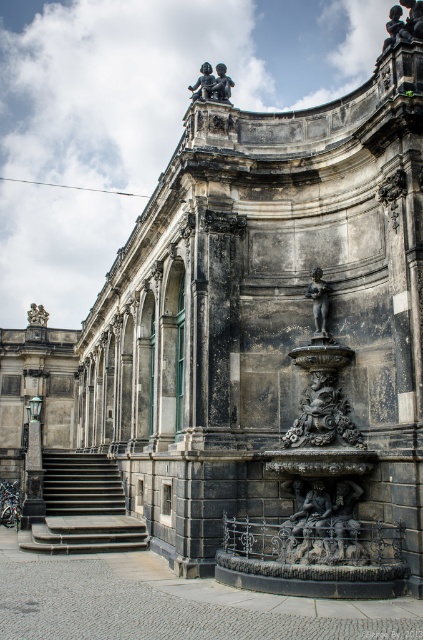
You are standing in front of the historical building and notice a specific point marked at coordinates (324, 522). Based on the scene description, can you determine which part of the structure this point is located on?

The point is located on the dark stone sculpture at lower center.

You are standing in front of the historical building and want to take a photo. There are two points marked in the image at coordinates point (114, 460) and point (417, 13). Which point is closer to your camera lens?

Point (114, 460) is further to the camera than point (417, 13). Therefore, point (417, 13) is closer to the camera lens.